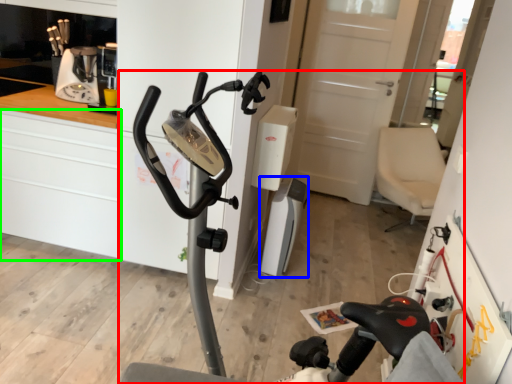
Question: Which is farther away from stationary bicycle (highlighted by a red box)? appliance (highlighted by a blue box) or cabinetry (highlighted by a green box)?

Choices:
 (A) appliance
 (B) cabinetry

Answer: (B)